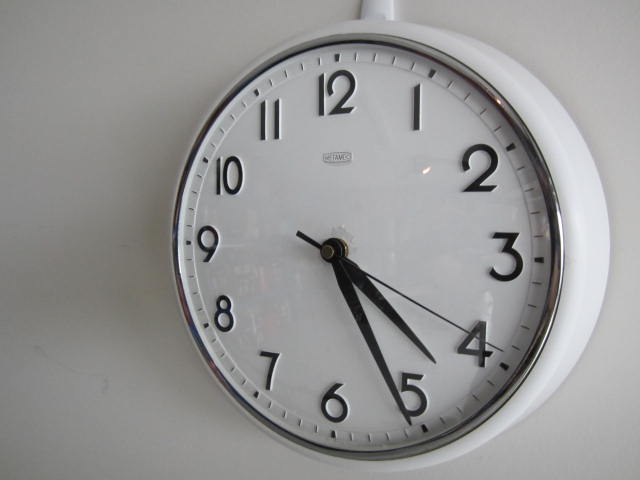
Where is `cream wall`? cream wall is located at coordinates (112, 66), (93, 298), (125, 415), (612, 66), (601, 408).